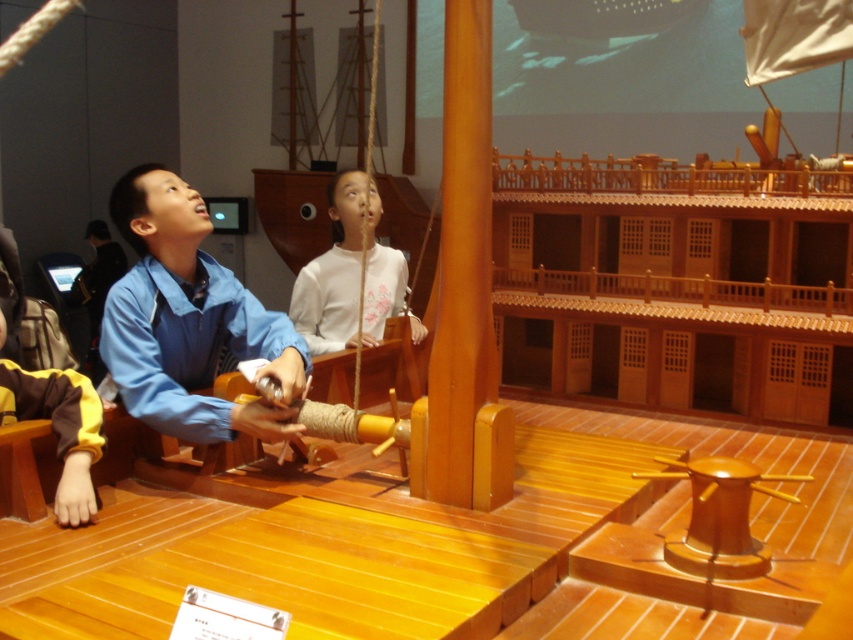
What is the exact location of the blue fabric shirt at center in the image?

The blue fabric shirt at center is located at point (189, 321).

What is the exact 2D coordinate of the white matte shirt at center in the image?

The white matte shirt at center is located at the coordinate point of [332,273].

You are a security guard in the museum. You need to ensure visitors maintain a minimum distance of 1 meter between each other for safety. There is a white matte shirt at center and a yellow fabric sleeve at lower left in the scene. Are these two visitors complying with the safety distance rule?

The white matte shirt at center is 1.19 meters away from the yellow fabric sleeve at lower left. Since the required minimum distance is 1 meter, they are complying with the safety distance rule as they are slightly over the required distance.